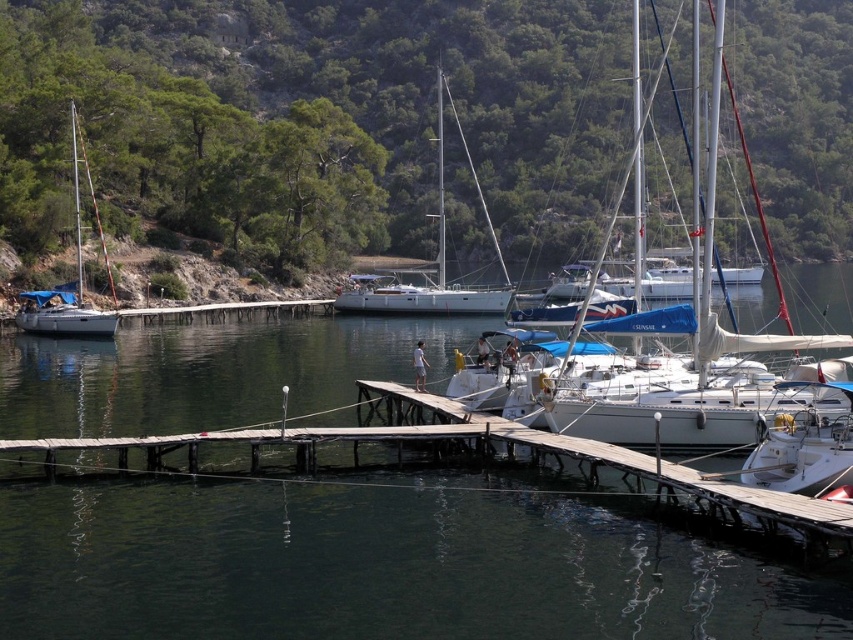
Question: In this image, where is white glossy sailboat at center located relative to white matte sailboat at left?

Choices:
 (A) above
 (B) below

Answer: (A)

Question: Can you confirm if wooden dock at center is positioned below white matte sailboat at left?

Choices:
 (A) no
 (B) yes

Answer: (B)

Question: Which point is closer to the camera taking this photo?

Choices:
 (A) (352, 451)
 (B) (73, 193)
 (C) (498, 248)

Answer: (A)

Question: Which of the following is the farthest from the observer?

Choices:
 (A) (67, 308)
 (B) (437, 257)

Answer: (B)

Question: Does white glossy sailboat at center have a smaller size compared to white matte sailboat at left?

Choices:
 (A) no
 (B) yes

Answer: (A)

Question: Which of these objects is positioned closest to the white glossy sailboat at center?

Choices:
 (A) white matte sailboat at left
 (B) wooden dock at center

Answer: (A)